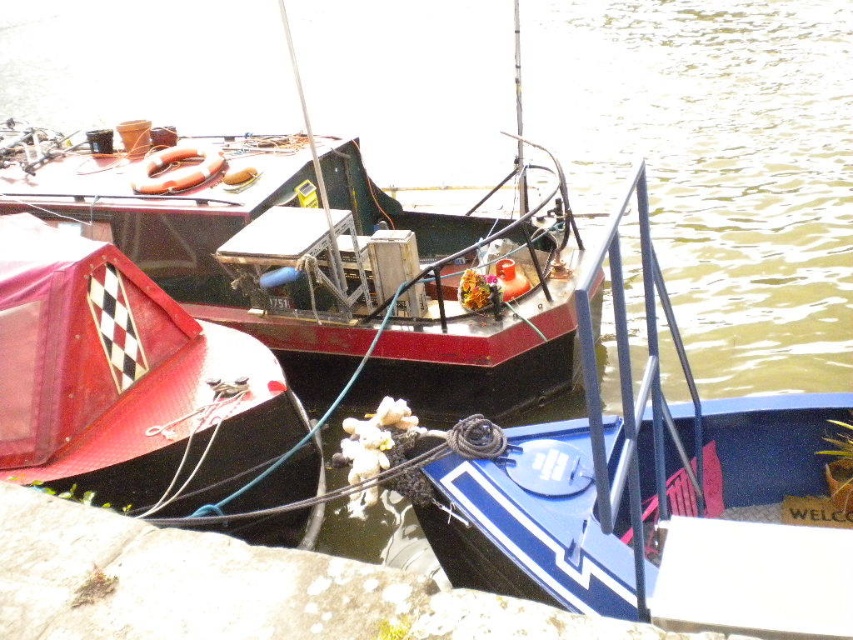
You are a sailor trying to board the red matte boat at left from the blue glossy boat at center. Can you do so without moving either boat?

The blue glossy boat at center is positioned under the red matte boat at left, so they are not adjacent. You cannot board the red matte boat at left from the blue glossy boat at center without moving either boat.

You are standing on the dock and see two points marked on the water. The first point is at coordinates point (663,522) and the second is at point (91,380). From your perspective, which point is closer to you?

Point (663,522) is in front of point (91,380), so it is closer to you.